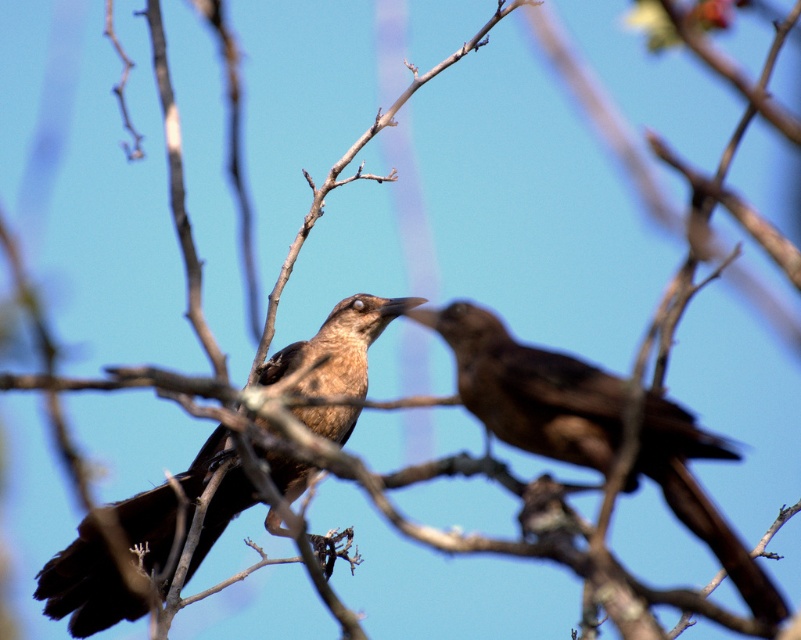
Question: Is brown matte bird at right bigger than brown matte bird at upper left?

Choices:
 (A) yes
 (B) no

Answer: (B)

Question: Which of the following is the closest to the observer?

Choices:
 (A) brown matte bird at right
 (B) brown matte bird at upper left

Answer: (A)

Question: Can you confirm if brown matte bird at right is thinner than brown matte bird at upper left?

Choices:
 (A) no
 (B) yes

Answer: (B)

Question: Does brown matte bird at right have a greater width compared to brown matte bird at upper left?

Choices:
 (A) no
 (B) yes

Answer: (A)